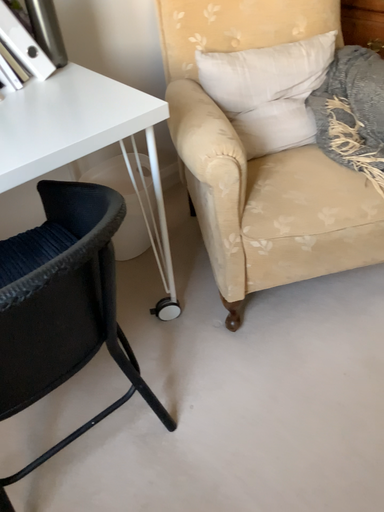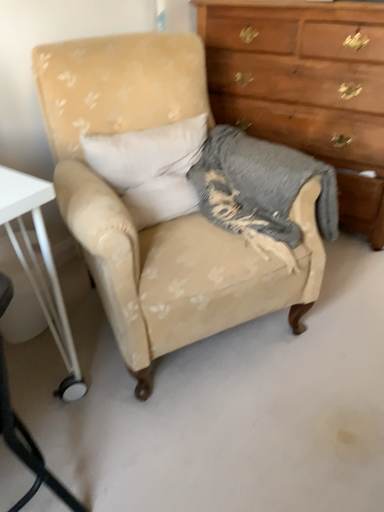
Question: How did the camera likely rotate when shooting the video?

Choices:
 (A) rotated upward
 (B) rotated downward

Answer: (A)